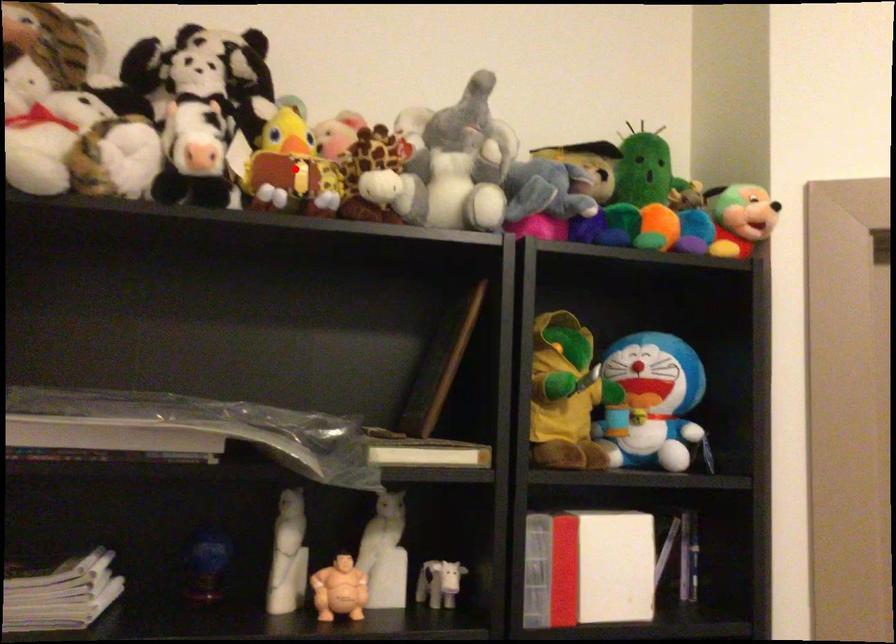
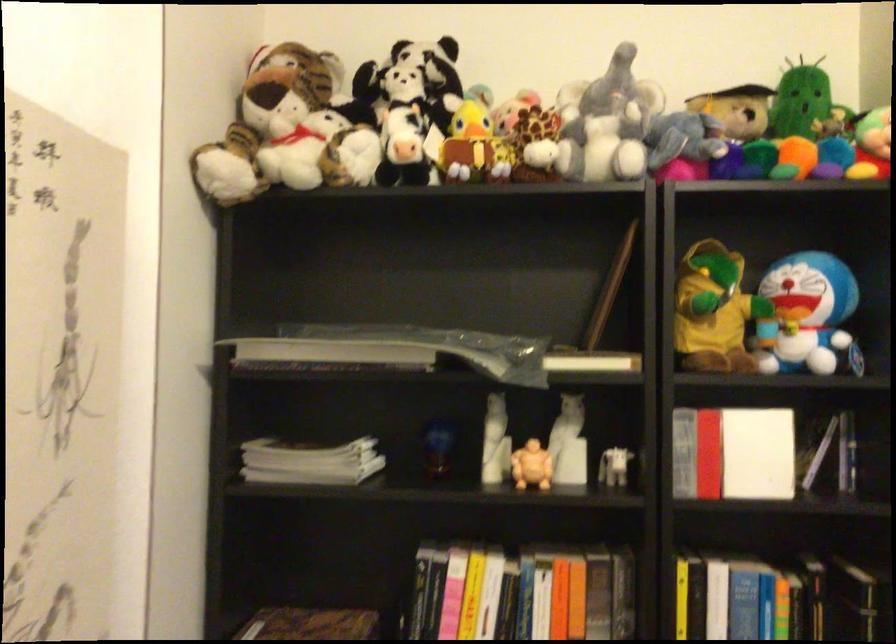
Question: I am providing you with two images of the same scene from different viewpoints. In image1, a red point is highlighted. Considering the same 3D point in image2, which of the following is correct?

Choices:
 (A) It is closer
 (B) It is farther

Answer: (B)